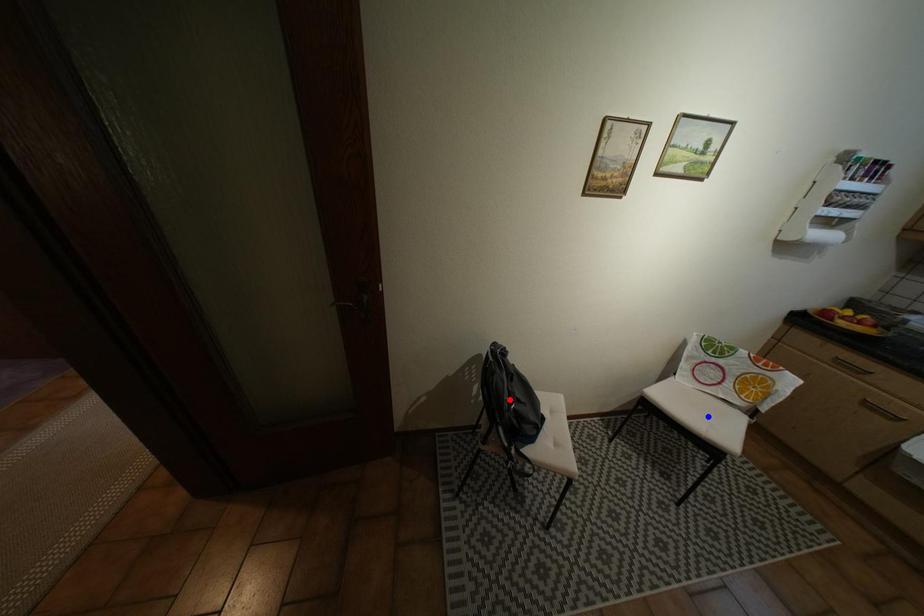
Question: Which of the two points in the image is closer to the camera?

Choices:
 (A) Blue point is closer.
 (B) Red point is closer.

Answer: (B)